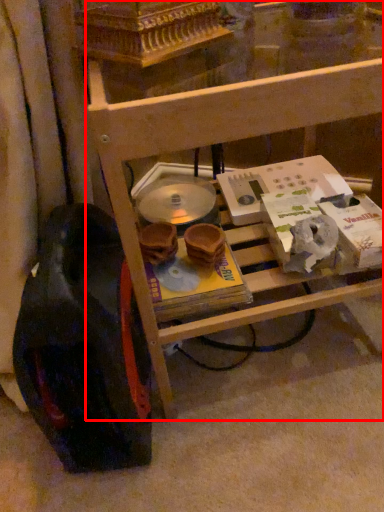
Question: Observing the image, what is the correct spatial positioning of furniture (annotated by the red box) in reference to wheel?

Choices:
 (A) right
 (B) left

Answer: (A)